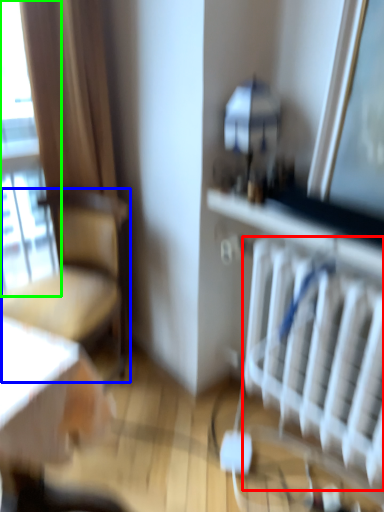
Question: Estimate the real-world distances between objects in this image. Which object is closer to radiator (highlighted by a red box), chair (highlighted by a blue box) or window (highlighted by a green box)?

Choices:
 (A) chair
 (B) window

Answer: (A)